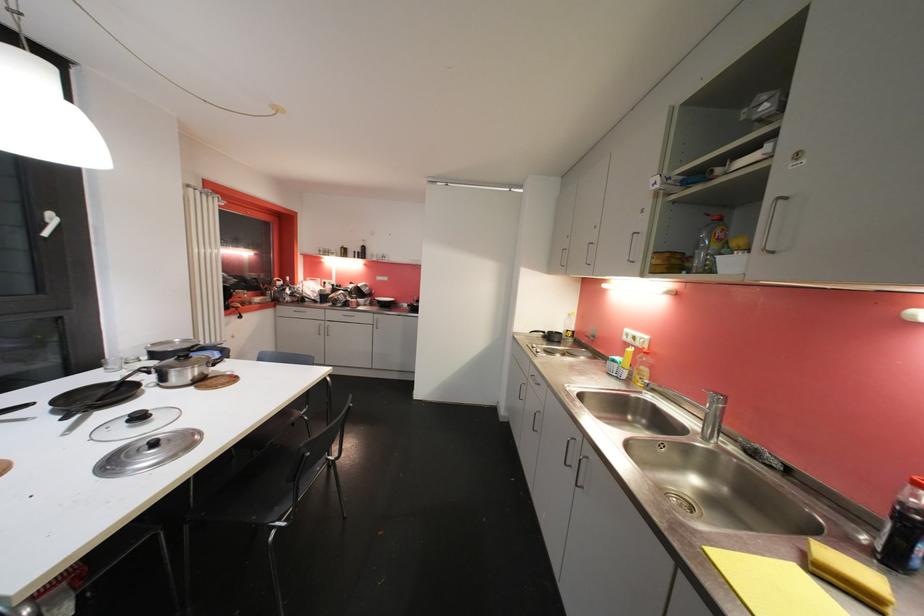
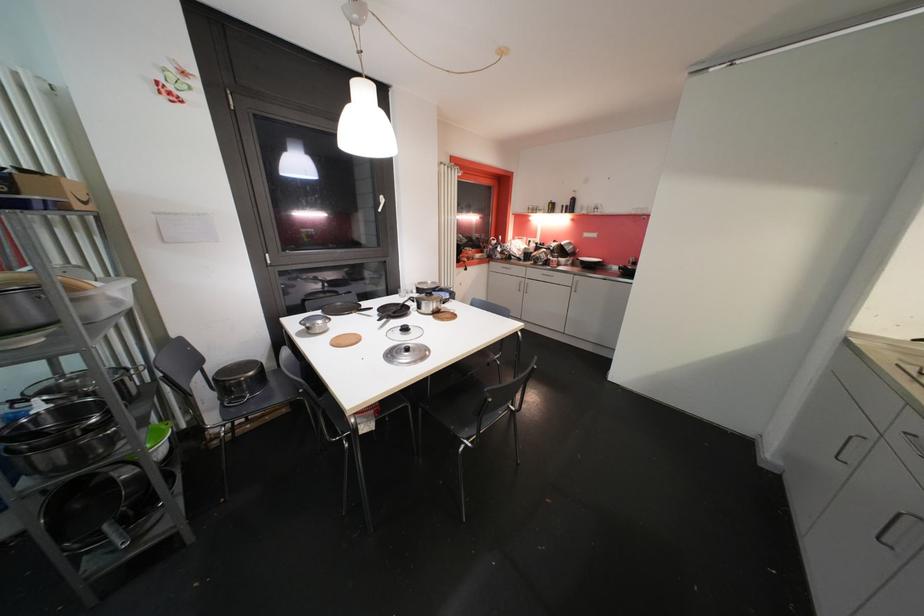
Locate, in the second image, the point that corresponds to (x=45, y=411) in the first image.

(379, 315)